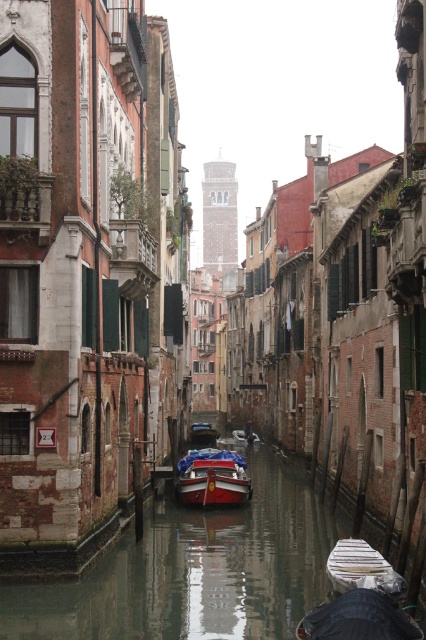
Question: Considering the relative positions of white plastic boat at center and wooden polished boat at center in the image provided, where is white plastic boat at center located with respect to wooden polished boat at center?

Choices:
 (A) left
 (B) right

Answer: (B)

Question: Which point appears farthest from the camera in this image?

Choices:
 (A) (212, 481)
 (B) (255, 529)
 (C) (356, 577)

Answer: (A)

Question: Which object is positioned farthest from the wooden polished boat at center?

Choices:
 (A) shiny red boat at center
 (B) smooth concrete canal at center
 (C) white plastic boat at center

Answer: (C)

Question: Which of the following is the closest to the observer?

Choices:
 (A) wooden polished boat at center
 (B) white plastic boat at center
 (C) smooth concrete canal at center
 (D) shiny red boat at center

Answer: (B)

Question: Is shiny red boat at center closer to the viewer compared to white plastic boat at center?

Choices:
 (A) no
 (B) yes

Answer: (A)

Question: Can you confirm if shiny red boat at center is thinner than wooden polished boat at center?

Choices:
 (A) no
 (B) yes

Answer: (A)